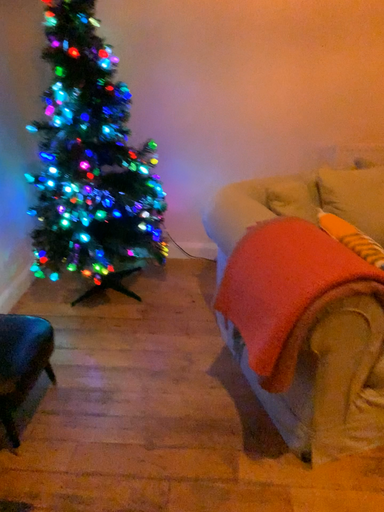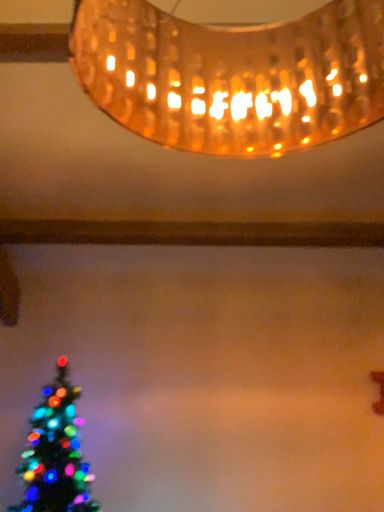
Question: How did the camera likely rotate when shooting the video?

Choices:
 (A) rotated upward
 (B) rotated downward

Answer: (A)